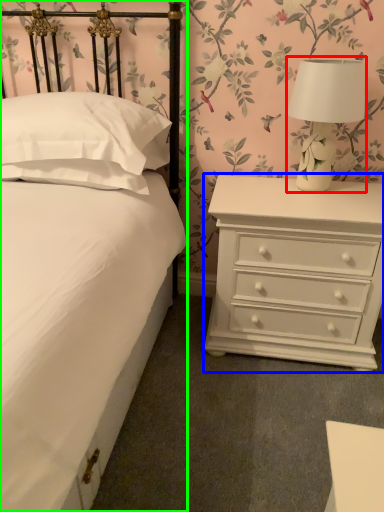
Question: Based on their relative distances, which object is farther from table lamp (highlighted by a red box)? Choose from chest of drawers (highlighted by a blue box) and bed (highlighted by a green box).

Choices:
 (A) chest of drawers
 (B) bed

Answer: (B)